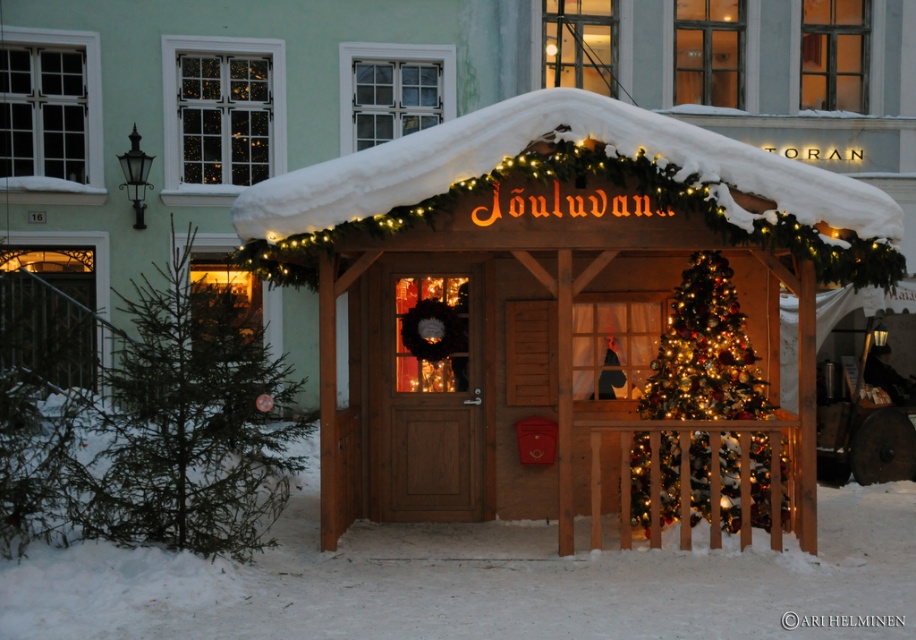
Question: Can you confirm if wooden gazebo at center is positioned below wooden door at center?

Choices:
 (A) yes
 (B) no

Answer: (B)

Question: Which object is the closest to the iridescent glass christmas tree at center?

Choices:
 (A) snow-covered wooden canopy at center
 (B) wooden door at center
 (C) wooden gazebo at center

Answer: (C)

Question: Can you confirm if snow-covered wooden canopy at center is thinner than iridescent glass christmas tree at center?

Choices:
 (A) yes
 (B) no

Answer: (B)

Question: Which point is farther to the camera?

Choices:
 (A) (469, 136)
 (B) (679, 376)

Answer: (B)

Question: Estimate the real-world distances between objects in this image. Which object is farther from the wooden gazebo at center?

Choices:
 (A) wooden door at center
 (B) snow-covered wooden canopy at center

Answer: (A)

Question: From the image, what is the correct spatial relationship of wooden gazebo at center in relation to snow-covered wooden canopy at center?

Choices:
 (A) below
 (B) above

Answer: (A)